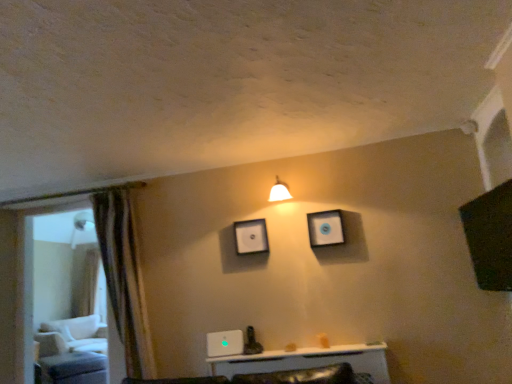
Question: Is matte black picture frame at upper center, the second picture frame viewed from the front, taller or shorter than white fabric swivel chair at left?

Choices:
 (A) short
 (B) tall

Answer: (A)

Question: Considering the relative positions of matte black picture frame at upper center, the first picture frame from the left, and white fabric swivel chair at left in the image provided, is matte black picture frame at upper center, the first picture frame from the left, to the left or to the right of white fabric swivel chair at left?

Choices:
 (A) right
 (B) left

Answer: (A)

Question: Estimate the real-world distances between objects in this image. Which object is farther from the matte black picture frame at upper center, the second picture frame viewed from the front?

Choices:
 (A) white glossy light fixture at upper center
 (B) white fabric swivel chair at left
 (C) matte white picture frame at upper center, which is counted as the second picture frame, starting from the back
 (D) matte black ottoman at lower left
 (E) transparent glass door at left

Answer: (E)

Question: Considering the real-world distances, which object is farthest from the white fabric swivel chair at left?

Choices:
 (A) white glossy light fixture at upper center
 (B) matte black ottoman at lower left
 (C) matte black picture frame at upper center, which appears as the first picture frame when viewed from the back
 (D) matte white picture frame at upper center, the 1th picture frame viewed from the front
 (E) transparent glass door at left

Answer: (D)